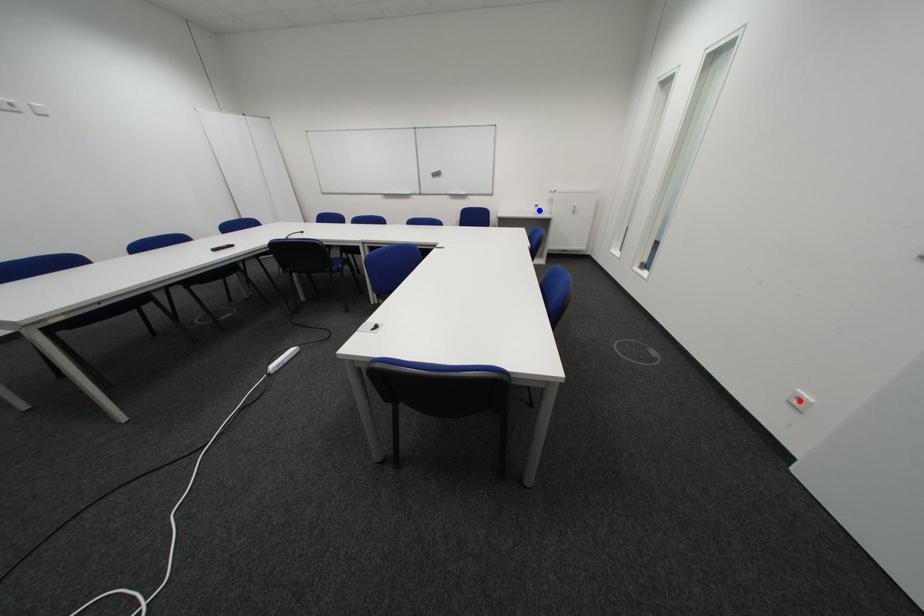
Question: In the image, two points are highlighted. Which point is nearer to the camera? Reply with the corresponding letter.

Choices:
 (A) blue point
 (B) red point

Answer: (B)